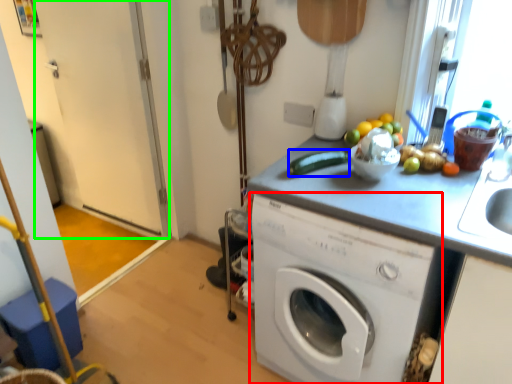
Question: Which is nearer to the washing machine (highlighted by a red box)? vegetable (highlighted by a blue box) or screen door (highlighted by a green box).

Choices:
 (A) vegetable
 (B) screen door

Answer: (A)